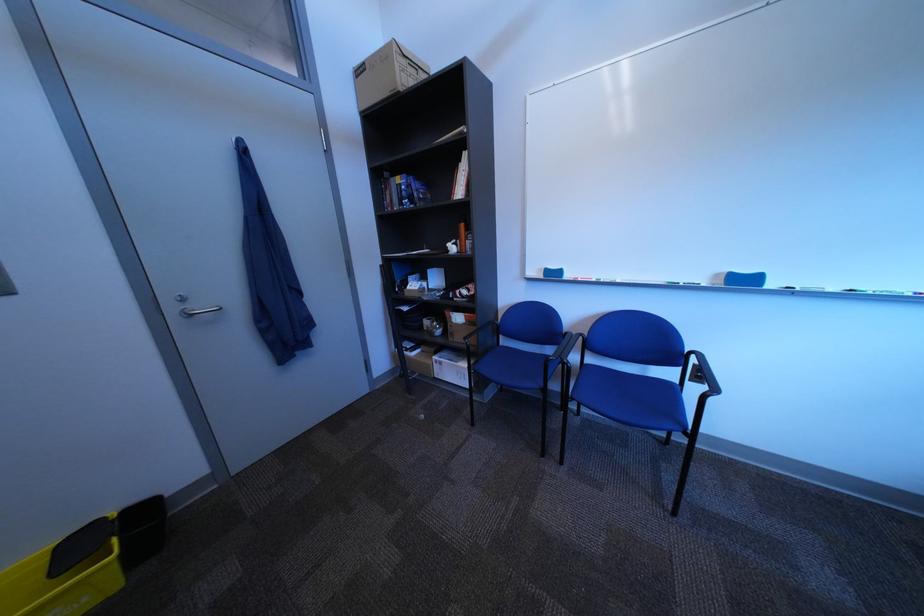
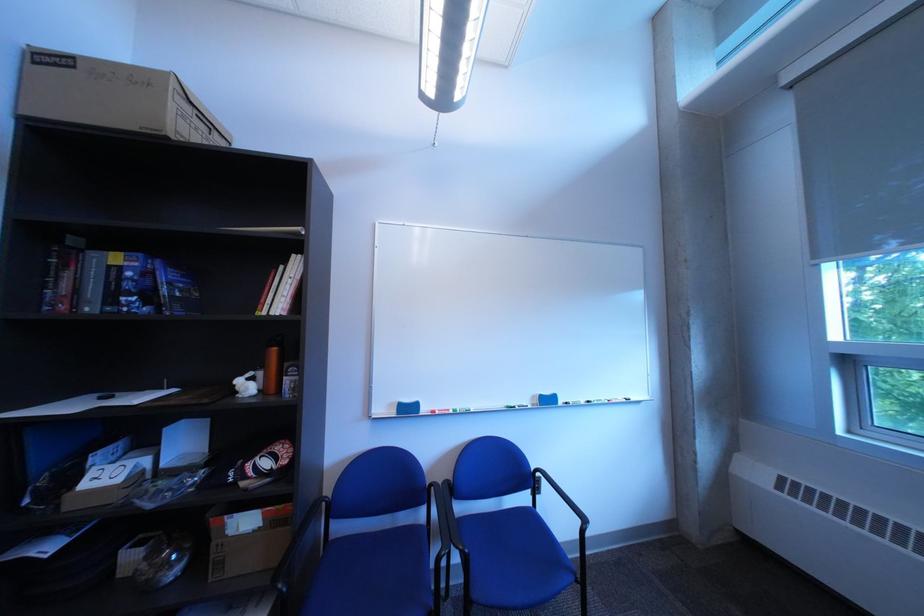
Where in the second image is the point corresponding to pixel 468 243 from the first image?

(264, 376)